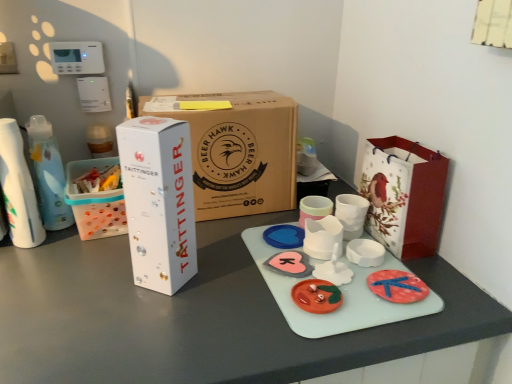
Where is `vacant space in front of white glossy box at left, which ranks as the second box in back-to-front order`? The image size is (512, 384). vacant space in front of white glossy box at left, which ranks as the second box in back-to-front order is located at coordinates (150, 331).